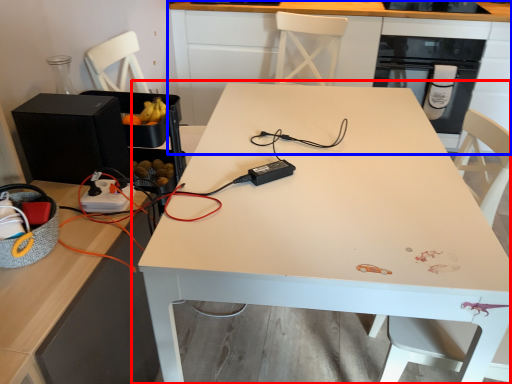
Question: Among these objects, which one is nearest to the camera, table (highlighted by a red box) or cabinetry (highlighted by a blue box)?

Choices:
 (A) table
 (B) cabinetry

Answer: (A)